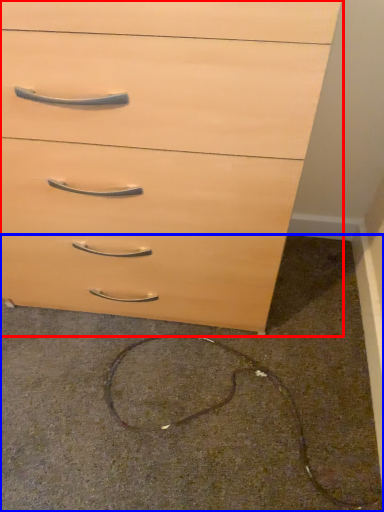
Question: Which object appears farthest to the camera in this image, chest of drawers (highlighted by a red box) or concrete (highlighted by a blue box)?

Choices:
 (A) chest of drawers
 (B) concrete

Answer: (B)